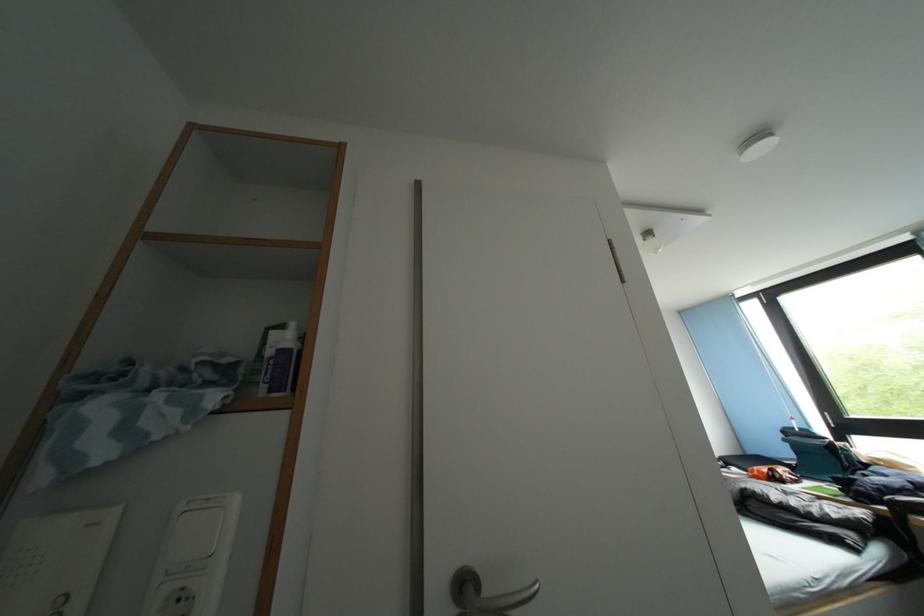
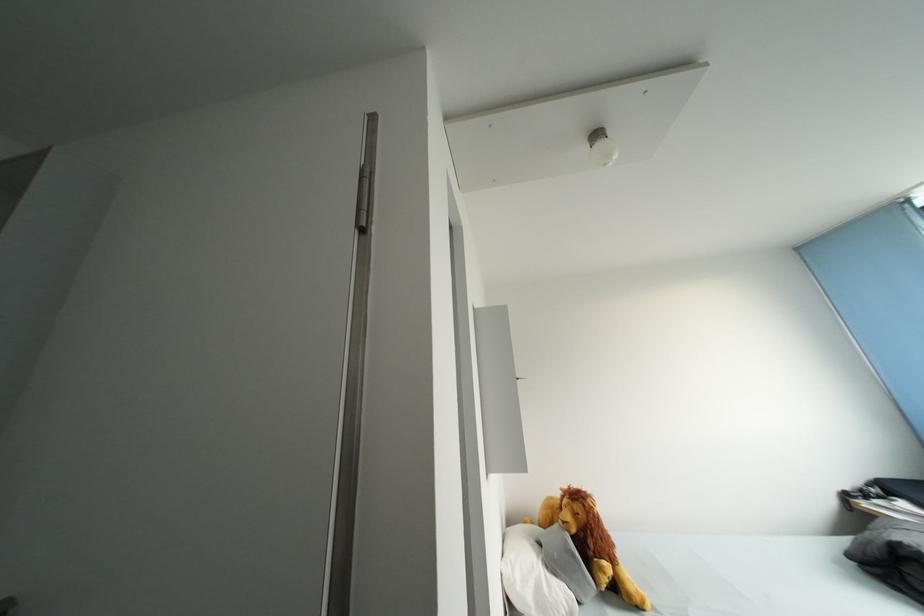
Question: The camera is either moving clockwise (left) or counter-clockwise (right) around the object. The first image is from the beginning of the video and the second image is from the end. Is the camera moving left or right when shooting the video?

Choices:
 (A) Left
 (B) Right

Answer: (B)